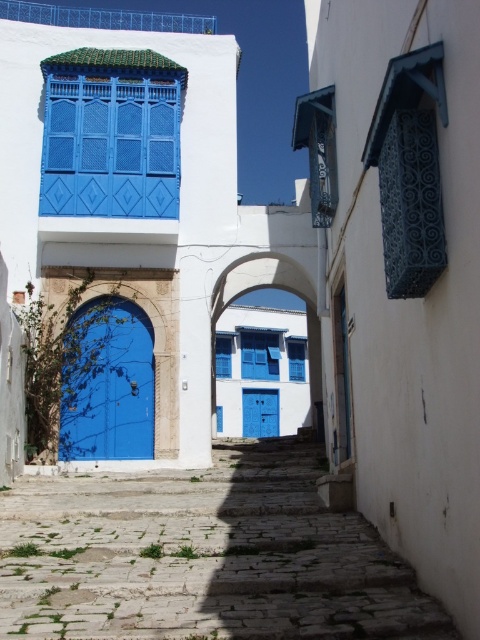
Which is above, blue glossy door at center or blue matte door at center?

blue glossy door at center is higher up.

Who is more forward, [61,442] or [247,432]?

Point [61,442] is in front.

Locate an element on the screen. The image size is (480, 640). blue glossy door at center is located at coordinates (108, 384).

Can you confirm if stone cobblestone stairs at center is positioned to the right of blue glossy door at center?

Yes, stone cobblestone stairs at center is to the right of blue glossy door at center.

Between point (388, 625) and point (100, 428), which one is positioned behind?

Positioned behind is point (100, 428).

Between point (399, 572) and point (148, 371), which one is positioned behind?

Point (148, 371)

Locate an element on the screen. stone cobblestone stairs at center is located at coordinates (304, 557).

Is stone cobblestone stairs at center in front of blue matte door at center?

Yes, it is in front of blue matte door at center.

Between point (367, 584) and point (276, 410), which one is positioned in front?

Point (367, 584) is in front.

You are a GUI agent. You are given a task and a screenshot of the screen. Output one action in this format:
    pyautogui.click(x=<x>, y=<y>)
    Task: Click on the stone cobblestone stairs at center
    Image resolution: width=480 pixels, height=640 pixels.
    Given the screenshot: What is the action you would take?
    pyautogui.click(x=304, y=557)

Identify the location of stone cobblestone stairs at center. The width and height of the screenshot is (480, 640). (304, 557).